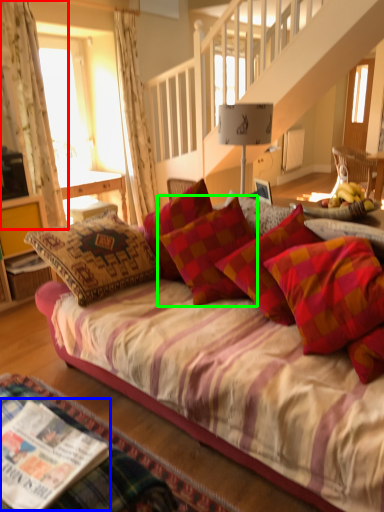
Question: Considering the real-world distances, which object is closest to curtain (highlighted by a red box)? magazine (highlighted by a blue box) or pillow (highlighted by a green box).

Choices:
 (A) magazine
 (B) pillow

Answer: (B)